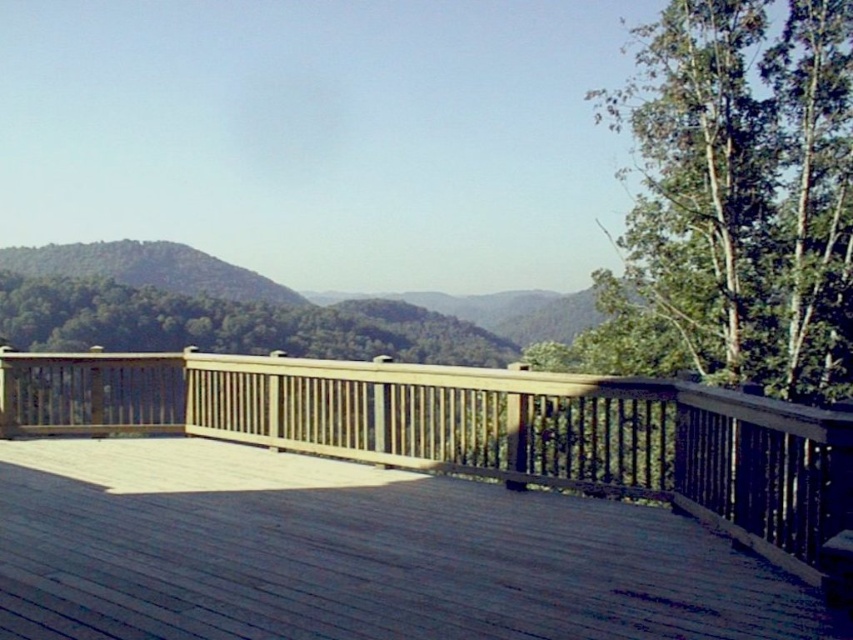
Question: Does wooden deck at center appear on the right side of green leafy tree at upper right?

Choices:
 (A) no
 (B) yes

Answer: (A)

Question: Which object is farther from the camera taking this photo?

Choices:
 (A) green leafy tree at upper right
 (B) wooden deck at center

Answer: (A)

Question: Is wooden deck at center behind green leafy tree at upper right?

Choices:
 (A) yes
 (B) no

Answer: (B)

Question: Is wooden deck at center above green leafy tree at upper right?

Choices:
 (A) no
 (B) yes

Answer: (A)

Question: Which of the following is the farthest from the observer?

Choices:
 (A) (764, 211)
 (B) (679, 476)

Answer: (A)